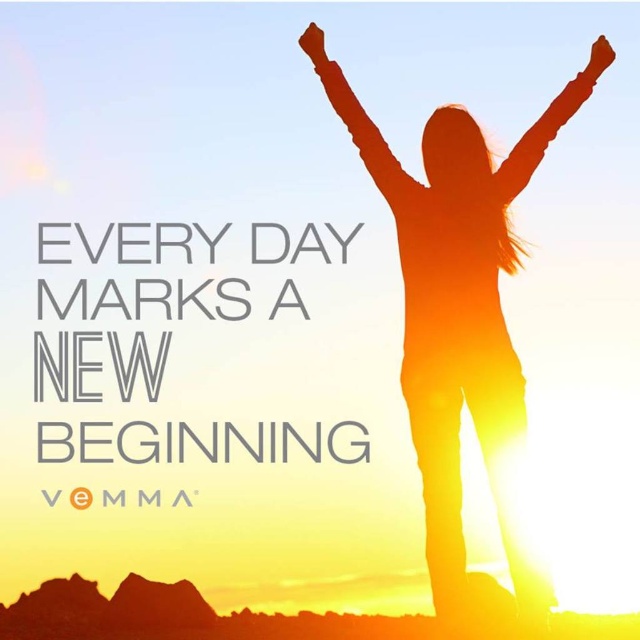
Can you confirm if silhouette arm at upper center is smaller than matte brown hand at upper center?

No.

Identify the location of silhouette arm at upper center. The height and width of the screenshot is (640, 640). 540,138.

Between orange matte arm at upper center and silhouette arm at upper center, which one has less height?

With less height is silhouette arm at upper center.

Does orange matte arm at upper center have a larger size compared to silhouette arm at upper center?

Correct, orange matte arm at upper center is larger in size than silhouette arm at upper center.

Is point (324, 68) farther from viewer compared to point (516, 182)?

Yes, it is behind point (516, 182).

I want to click on orange matte arm at upper center, so click(369, 140).

Between orange matte arm at upper center and matte orange hand at upper right, which one has less height?

matte orange hand at upper right

Between point (376, 134) and point (598, 42), which one is positioned in front?

Point (376, 134)

Does point (336, 81) come in front of point (595, 68)?

Yes, it is.

This screenshot has width=640, height=640. I want to click on orange matte arm at upper center, so click(x=369, y=140).